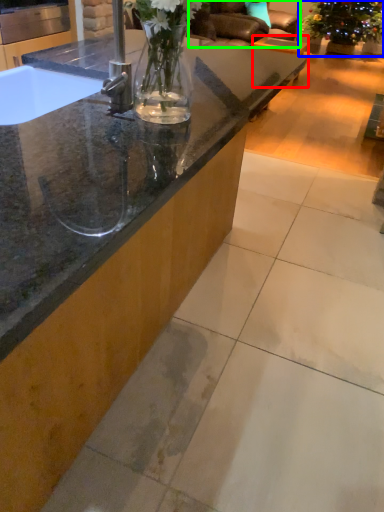
Question: Estimate the real-world distances between objects in this image. Which object is farther from table (highlighted by a red box), houseplant (highlighted by a blue box) or armchair (highlighted by a green box)?

Choices:
 (A) houseplant
 (B) armchair

Answer: (B)